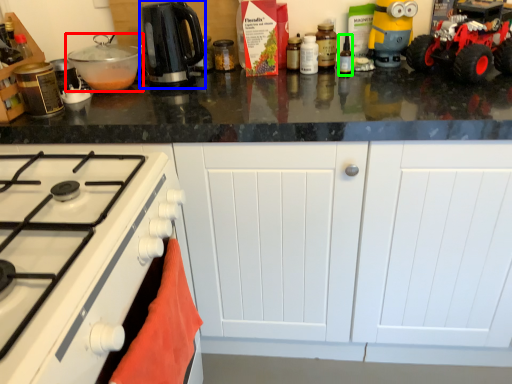
Question: Considering the real-world distances, which object is closest to kitchen appliance (highlighted by a red box)? kitchen appliance (highlighted by a blue box) or bottle (highlighted by a green box).

Choices:
 (A) kitchen appliance
 (B) bottle

Answer: (A)